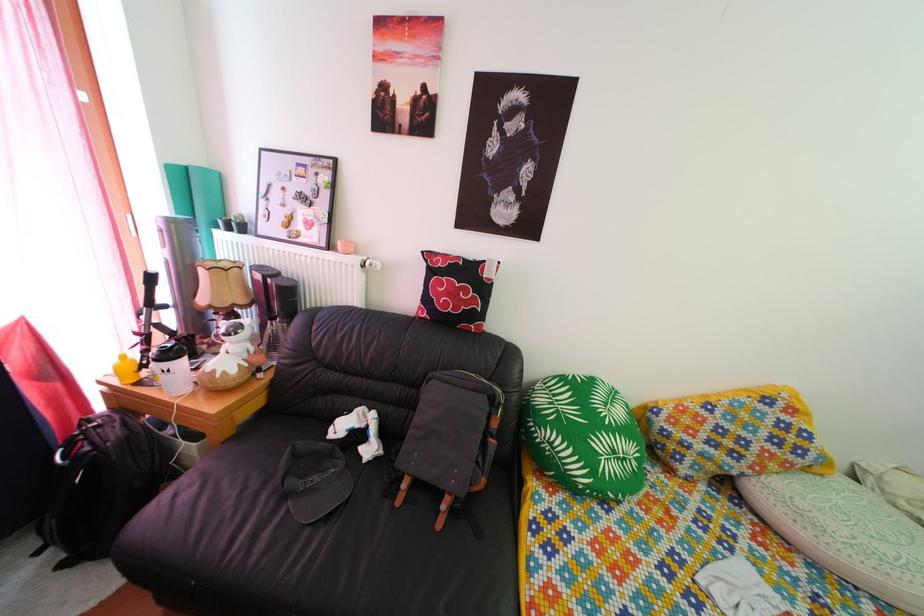
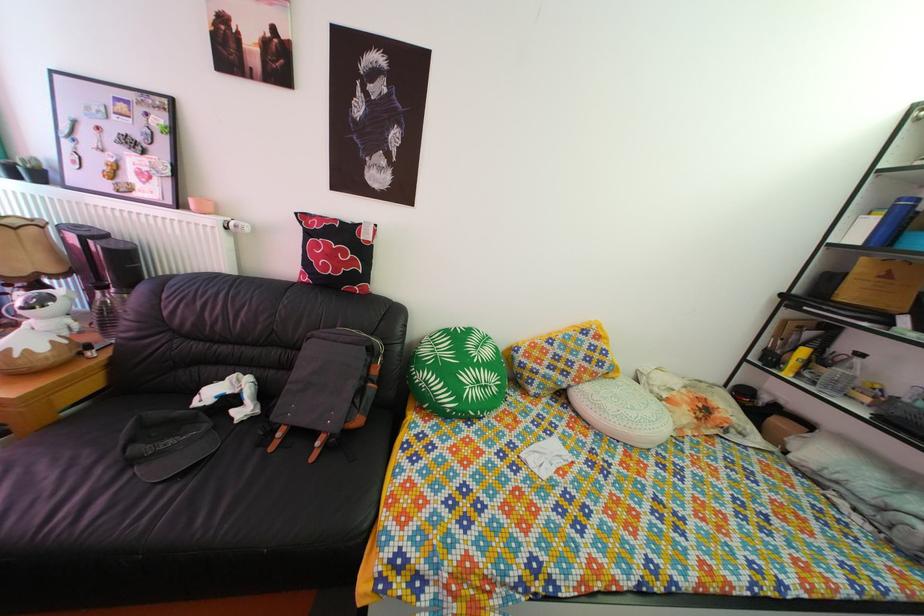
Locate, in the second image, the point that corresponds to pixel 275 325 in the first image.

(103, 294)